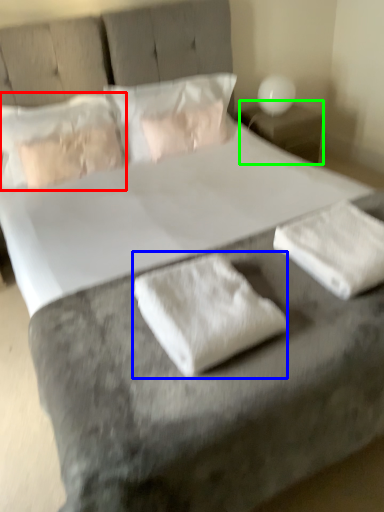
Question: Which object is the closest to the pillow (highlighted by a red box)? Choose among these: material (highlighted by a blue box) or nightstand (highlighted by a green box).

Choices:
 (A) material
 (B) nightstand

Answer: (B)